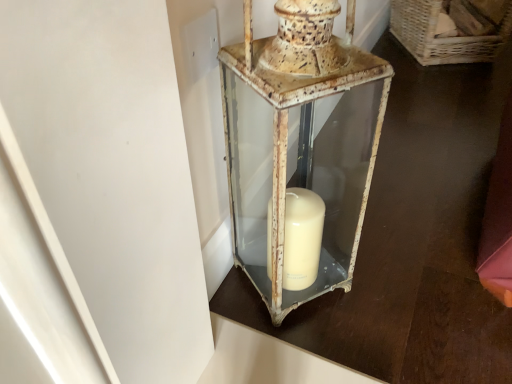
Find the location of `vacant area that is situated to the right of rusty metal lantern at center`. vacant area that is situated to the right of rusty metal lantern at center is located at coordinates (387, 287).